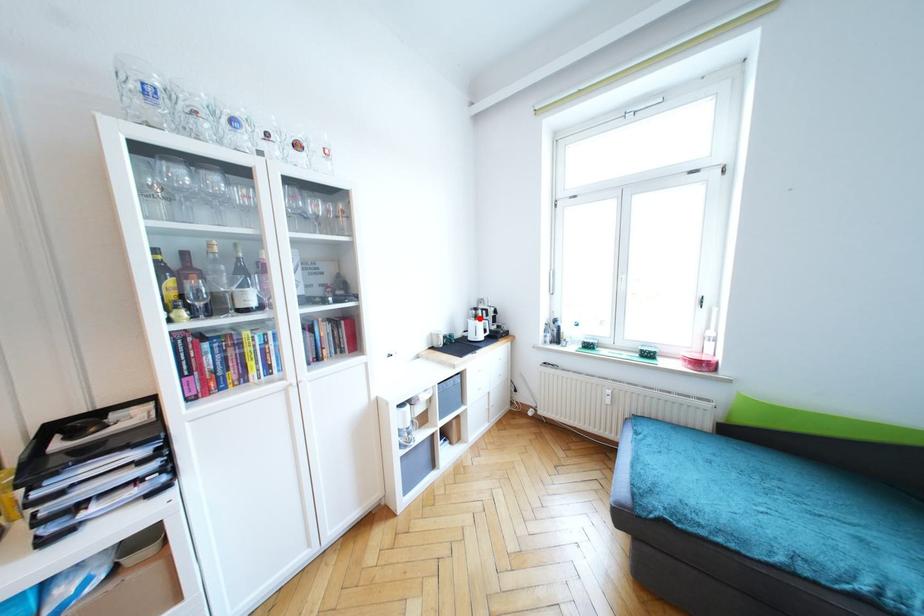
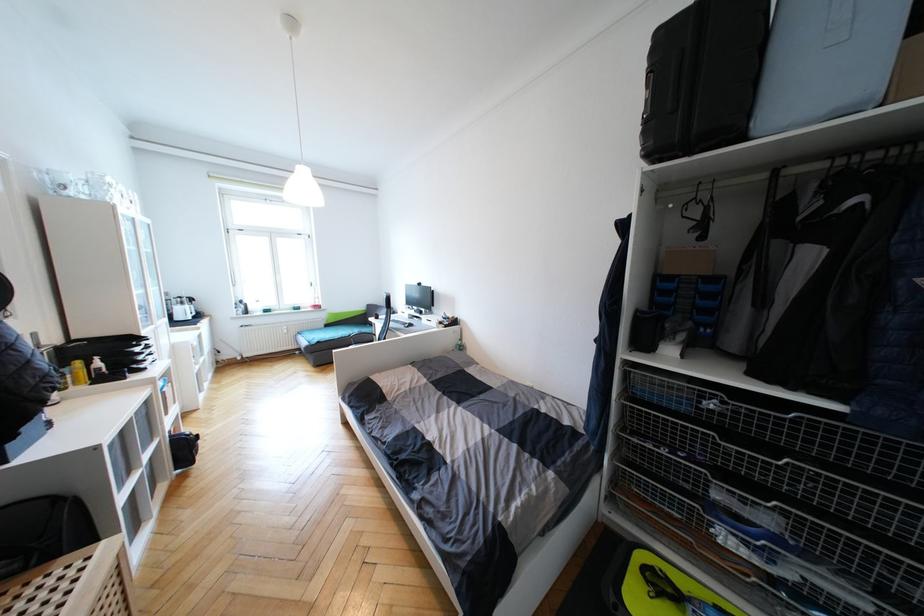
Where in the second image is the point corresponding to the highlighted location from the first image?

(186, 305)